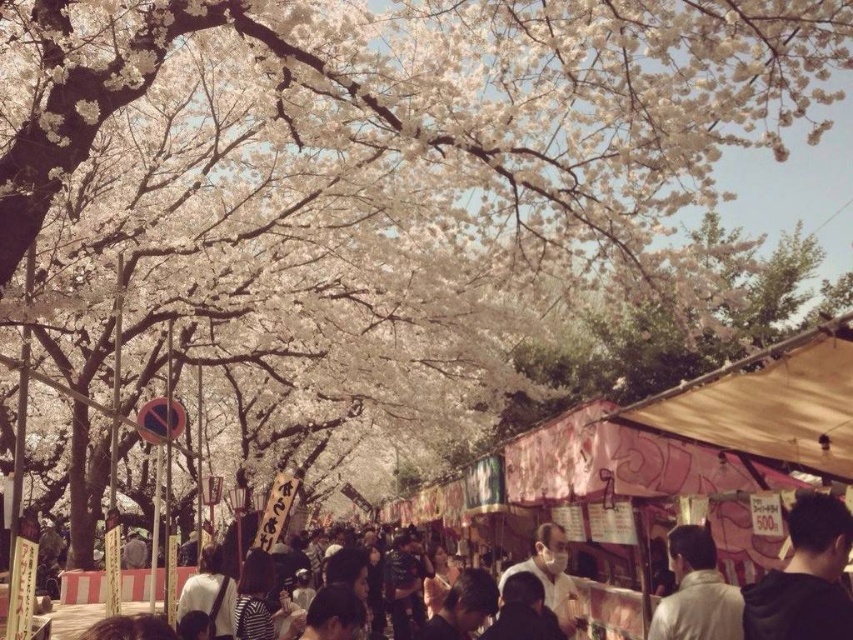
You are a photographer aiming to capture a clear shot of both the black matte hair at lower right and the white matte jacket at center. Considering their sizes, which object should you focus on first to ensure both are in frame without zooming?

Since the black matte hair at lower right is smaller than the white matte jacket at center, you should focus on the black matte hair at lower right first to ensure it fits into the frame before adjusting for the larger white matte jacket at center.

You are a photographer standing in the middle of the cherry blossom pathway. You notice two people in the scene, one with black matte hair at lower right and another wearing a matte black mask at center. Which person is shorter in height?

The black matte hair at lower right has a lesser height compared to the matte black mask at center, so the person with black matte hair at lower right is shorter.